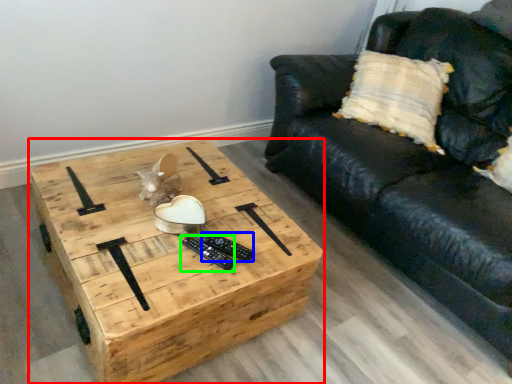
Question: Which object is positioned farthest from coffee table (highlighted by a red box)? Select from remote (highlighted by a blue box) and remote (highlighted by a green box).

Choices:
 (A) remote
 (B) remote

Answer: (A)